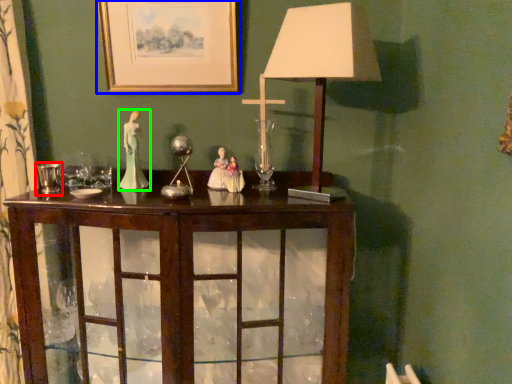
Question: Considering the real-world distances, which object is closest to candle holder (highlighted by a red box)? picture frame (highlighted by a blue box) or person (highlighted by a green box).

Choices:
 (A) picture frame
 (B) person

Answer: (B)